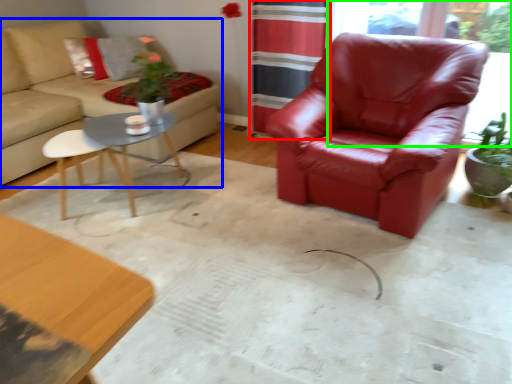
Question: Estimate the real-world distances between objects in this image. Which object is closer to curtain (highlighted by a red box), studio couch (highlighted by a blue box) or window screen (highlighted by a green box)?

Choices:
 (A) studio couch
 (B) window screen

Answer: (A)